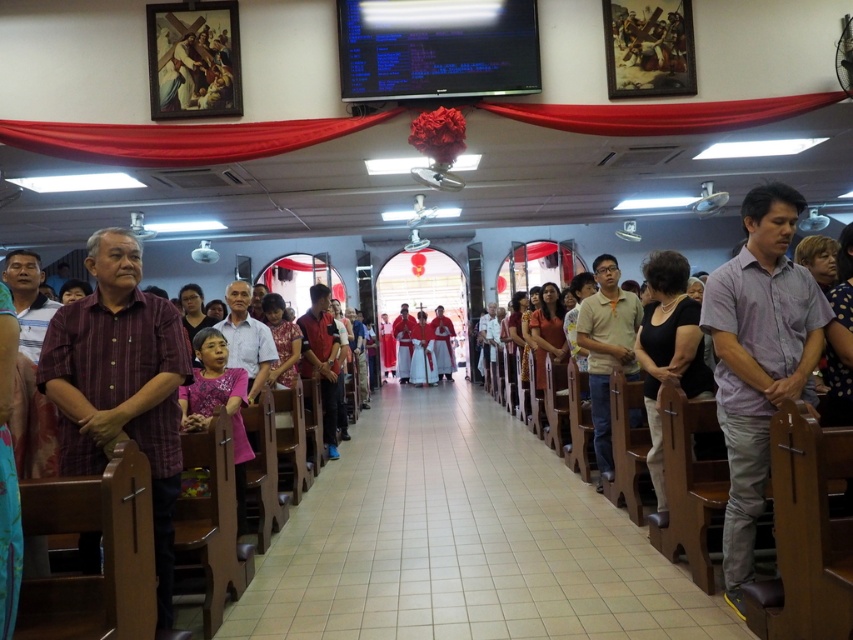
Can you confirm if purple cotton shirt at center is positioned to the right of orange cotton polo shirt at center?

Correct, you'll find purple cotton shirt at center to the right of orange cotton polo shirt at center.

Between point (804, 371) and point (595, 304), which one is positioned behind?

The point (595, 304) is behind.

Is point (733, 298) farther from camera compared to point (598, 307)?

No, it is not.

Where is `purple cotton shirt at center`? The image size is (853, 640). purple cotton shirt at center is located at coordinates (759, 358).

Can you confirm if white tile aisle at center is positioned to the right of purple wood shirt at center?

Yes, white tile aisle at center is to the right of purple wood shirt at center.

Which is behind, point (650, 612) or point (97, 332)?

Point (650, 612)

You are a GUI agent. You are given a task and a screenshot of the screen. Output one action in this format:
    pyautogui.click(x=<x>, y=<y>)
    Task: Click on the white tile aisle at center
    This screenshot has height=640, width=853.
    Given the screenshot: What is the action you would take?
    pyautogui.click(x=463, y=541)

Where is `white tile aisle at center`? white tile aisle at center is located at coordinates coord(463,541).

Who is shorter, white tile aisle at center or purple cotton shirt at center?

white tile aisle at center

Who is more distant from viewer, (491, 515) or (791, 337)?

The point (491, 515) is more distant.

Which is in front, point (567, 556) or point (746, 433)?

Point (746, 433) is more forward.

In order to click on white tile aisle at center in this screenshot , I will do `click(463, 541)`.